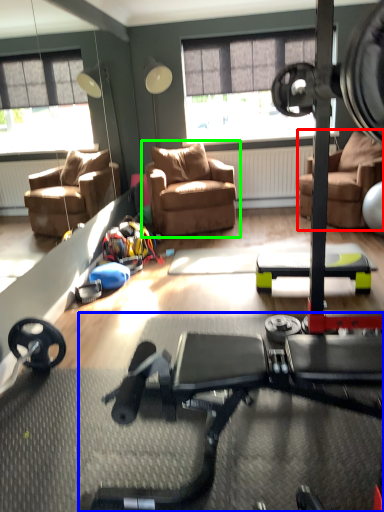
Question: Which is nearer to the chair (highlighted by a red box)? stationary bicycle (highlighted by a blue box) or chair (highlighted by a green box).

Choices:
 (A) stationary bicycle
 (B) chair

Answer: (B)